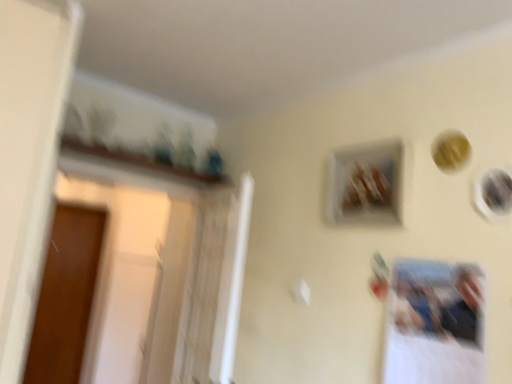
You are a GUI agent. You are given a task and a screenshot of the screen. Output one action in this format:
    pyautogui.click(x=<x>, y=<y>)
    Task: Click on the wooden frame at upper center, the 2th picture frame from the right
    
    Given the screenshot: What is the action you would take?
    pyautogui.click(x=366, y=185)

This screenshot has width=512, height=384. I want to click on matte black picture frame at upper right, arranged as the first picture frame when viewed from the right, so click(x=494, y=193).

What is the approximate height of matte black picture frame at upper right, the 2th picture frame viewed from the left?

matte black picture frame at upper right, the 2th picture frame viewed from the left, is 6.35 inches in height.

The height and width of the screenshot is (384, 512). Describe the element at coordinates (66, 295) in the screenshot. I see `brown wood screen door at left` at that location.

The width and height of the screenshot is (512, 384). I want to click on brown wood screen door at left, so click(x=66, y=295).

Where is `wooden frame at upper center, placed as the 2th picture frame when sorted from front to back`? The height and width of the screenshot is (384, 512). wooden frame at upper center, placed as the 2th picture frame when sorted from front to back is located at coordinates (366, 185).

From the image's perspective, relative to matte black picture frame at upper right, which ranks as the 2th picture frame in back-to-front order, is brown wood screen door at left above or below?

From the image's perspective, brown wood screen door at left appears below matte black picture frame at upper right, which ranks as the 2th picture frame in back-to-front order.

Considering the sizes of brown wood screen door at left and matte black picture frame at upper right, the 2th picture frame viewed from the left, in the image, is brown wood screen door at left bigger or smaller than matte black picture frame at upper right, the 2th picture frame viewed from the left,?

In the image, brown wood screen door at left appears to be larger than matte black picture frame at upper right, the 2th picture frame viewed from the left.

The width and height of the screenshot is (512, 384). I want to click on screen door lying below the matte black picture frame at upper right, the 2th picture frame viewed from the left (from the image's perspective), so click(66, 295).

Based on the photo, in terms of height, does brown wood screen door at left look taller or shorter compared to matte black picture frame at upper right, which is the first picture frame from front to back?

Clearly, brown wood screen door at left is taller compared to matte black picture frame at upper right, which is the first picture frame from front to back.

Considering the positions of points (499, 187) and (394, 146), is point (499, 187) farther from camera compared to point (394, 146)?

That is False.

Can we say matte black picture frame at upper right, the 2th picture frame viewed from the left, lies outside wooden frame at upper center, placed as the 2th picture frame when sorted from front to back?

Yes.

Is matte black picture frame at upper right, arranged as the first picture frame when viewed from the right, facing towards wooden frame at upper center, the 2th picture frame from the right?

No, matte black picture frame at upper right, arranged as the first picture frame when viewed from the right, is not oriented towards wooden frame at upper center, the 2th picture frame from the right.

Is brown wood screen door at left smaller than wooden frame at upper center, the 1th picture frame from the back?

No.

Does point (54, 367) come farther from viewer compared to point (371, 177)?

Yes.

Between brown wood screen door at left and wooden frame at upper center, the 2th picture frame from the right, which one appears on the left side from the viewer's perspective?

brown wood screen door at left.

Is wooden frame at upper center, the 2th picture frame from the right, located within brown wood screen door at left?

No, brown wood screen door at left does not contain wooden frame at upper center, the 2th picture frame from the right.

In terms of size, does wooden frame at upper center, the first picture frame from the left, appear bigger or smaller than matte black picture frame at upper right, arranged as the first picture frame when viewed from the right?

Clearly, wooden frame at upper center, the first picture frame from the left, is larger in size than matte black picture frame at upper right, arranged as the first picture frame when viewed from the right.

Visually, is wooden frame at upper center, the 2th picture frame from the right, positioned to the left or to the right of matte black picture frame at upper right, arranged as the first picture frame when viewed from the right?

Clearly, wooden frame at upper center, the 2th picture frame from the right, is on the left of matte black picture frame at upper right, arranged as the first picture frame when viewed from the right, in the image.

Would you say wooden frame at upper center, the 1th picture frame from the back, is outside matte black picture frame at upper right, which is the first picture frame from front to back?

Yes, wooden frame at upper center, the 1th picture frame from the back, is outside of matte black picture frame at upper right, which is the first picture frame from front to back.

Considering their positions, is matte black picture frame at upper right, arranged as the first picture frame when viewed from the right, located in front of or behind brown wood screen door at left?

matte black picture frame at upper right, arranged as the first picture frame when viewed from the right, is in front of brown wood screen door at left.

Based on the photo, from the image's perspective, between matte black picture frame at upper right, which is the first picture frame from front to back, and brown wood screen door at left, which one is located above?

matte black picture frame at upper right, which is the first picture frame from front to back, from the image's perspective.

Who is taller, matte black picture frame at upper right, arranged as the first picture frame when viewed from the right, or brown wood screen door at left?

Standing taller between the two is brown wood screen door at left.

Considering the relative sizes of matte black picture frame at upper right, arranged as the first picture frame when viewed from the right, and brown wood screen door at left in the image provided, is matte black picture frame at upper right, arranged as the first picture frame when viewed from the right, wider than brown wood screen door at left?

No.

Looking at this image, is wooden frame at upper center, the 2th picture frame from the right, positioned behind brown wood screen door at left?

No.

From a real-world perspective, does wooden frame at upper center, the 2th picture frame from the right, stand above brown wood screen door at left?

Indeed, from a real-world perspective, wooden frame at upper center, the 2th picture frame from the right, stands above brown wood screen door at left.

Is the surface of wooden frame at upper center, placed as the 2th picture frame when sorted from front to back, in direct contact with brown wood screen door at left?

No, wooden frame at upper center, placed as the 2th picture frame when sorted from front to back, is not in contact with brown wood screen door at left.

This screenshot has height=384, width=512. Identify the location of screen door on the left of matte black picture frame at upper right, the 2th picture frame viewed from the left. (66, 295).

I want to click on picture frame that is behind the matte black picture frame at upper right, which ranks as the 2th picture frame in back-to-front order, so tap(366, 185).

Based on their spatial positions, is wooden frame at upper center, the first picture frame from the left, or matte black picture frame at upper right, the 2th picture frame viewed from the left, further from brown wood screen door at left?

matte black picture frame at upper right, the 2th picture frame viewed from the left.

Which object lies nearer to the anchor point wooden frame at upper center, the first picture frame from the left, matte black picture frame at upper right, arranged as the first picture frame when viewed from the right, or brown wood screen door at left?

Among the two, matte black picture frame at upper right, arranged as the first picture frame when viewed from the right, is located nearer to wooden frame at upper center, the first picture frame from the left.

Consider the image. Estimate the real-world distances between objects in this image. Which object is closer to brown wood screen door at left, matte black picture frame at upper right, which ranks as the 2th picture frame in back-to-front order, or wooden frame at upper center, the 1th picture frame from the back?

Among the two, wooden frame at upper center, the 1th picture frame from the back, is located nearer to brown wood screen door at left.

Which object lies nearer to the anchor point matte black picture frame at upper right, which is the first picture frame from front to back, brown wood screen door at left or wooden frame at upper center, placed as the 2th picture frame when sorted from front to back?

The object closer to matte black picture frame at upper right, which is the first picture frame from front to back, is wooden frame at upper center, placed as the 2th picture frame when sorted from front to back.

Looking at the image, which one is located closer to matte black picture frame at upper right, which ranks as the 2th picture frame in back-to-front order, wooden frame at upper center, the 2th picture frame from the right, or brown wood screen door at left?

wooden frame at upper center, the 2th picture frame from the right, lies closer to matte black picture frame at upper right, which ranks as the 2th picture frame in back-to-front order, than the other object.

In the scene shown: Looking at the image, which one is located closer to wooden frame at upper center, the first picture frame from the left, brown wood screen door at left or matte black picture frame at upper right, which is the first picture frame from front to back?

The object closer to wooden frame at upper center, the first picture frame from the left, is matte black picture frame at upper right, which is the first picture frame from front to back.

In order to click on picture frame between matte black picture frame at upper right, arranged as the first picture frame when viewed from the right, and brown wood screen door at left in the front-back direction in this screenshot , I will do `click(366, 185)`.